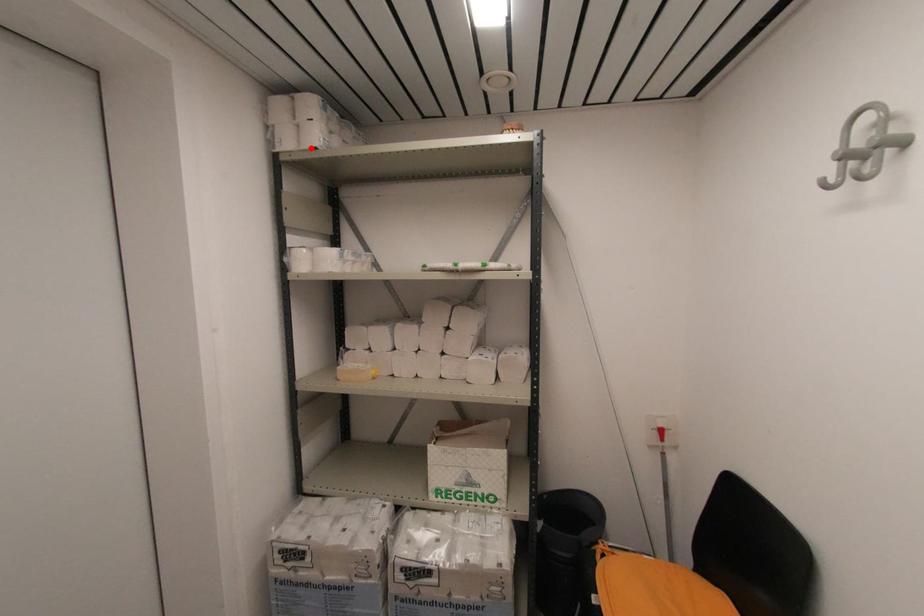
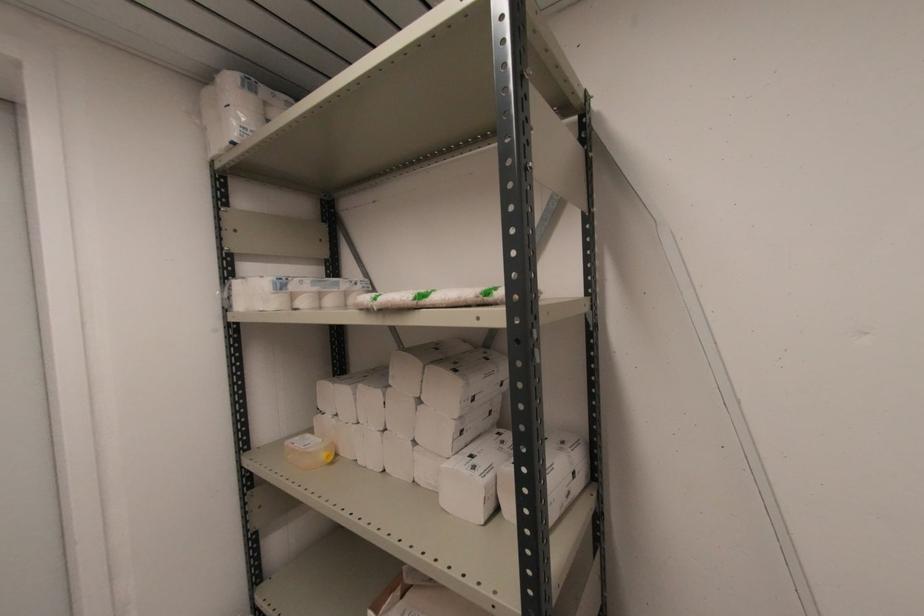
Find the pixel in the second image that matches the highlighted location in the first image.

(227, 144)